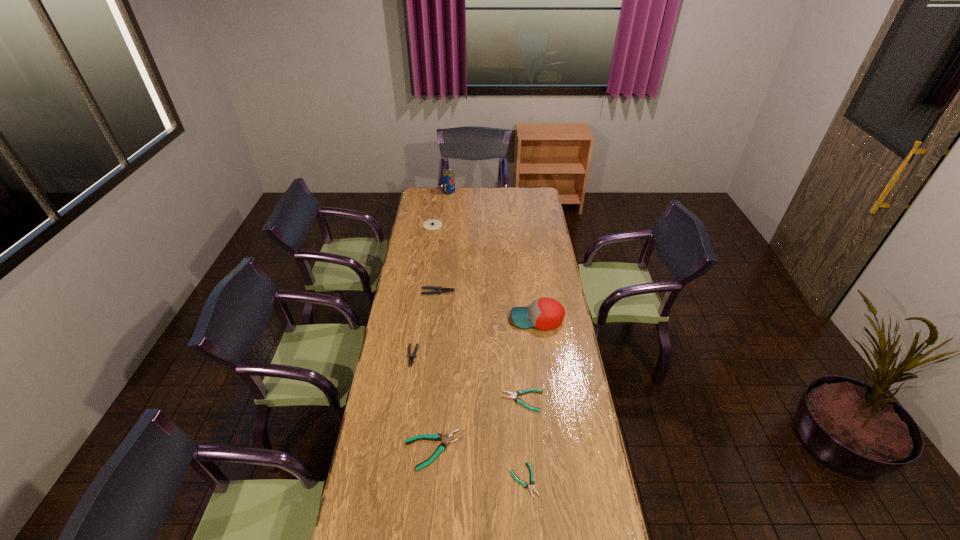
This screenshot has height=540, width=960. What are the coordinates of `the biggest teal pliers` in the screenshot? It's located at (446, 439).

The image size is (960, 540). In order to click on the sixth tallest object in this screenshot , I will do `click(446, 439)`.

This screenshot has height=540, width=960. In order to click on the second smallest teal pliers in this screenshot , I will do `click(520, 392)`.

The width and height of the screenshot is (960, 540). Find the location of `the farthest teal pliers`. the farthest teal pliers is located at coordinates (520, 392).

The image size is (960, 540). I want to click on the shortest pliers, so click(532, 481).

This screenshot has height=540, width=960. In order to click on the shortest object in this screenshot , I will do `click(532, 481)`.

Identify the location of vacant space located 0.110m on the front of the farthest object. The height and width of the screenshot is (540, 960). (447, 204).

Where is `free space located 0.150m at the brim of the second tallest object`? free space located 0.150m at the brim of the second tallest object is located at coordinates coord(478,319).

Locate an element on the screen. This screenshot has width=960, height=540. free space located 0.250m at the brim of the second tallest object is located at coordinates coord(457,319).

I want to click on free space located 0.180m at the brim of the second tallest object, so click(472, 319).